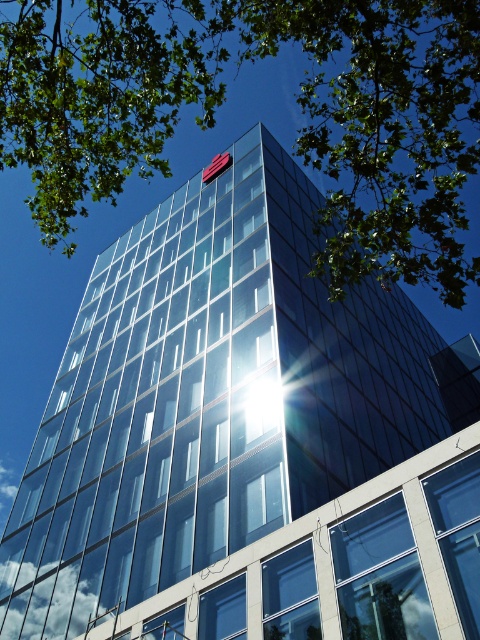
Consider the image. You are a photographer trying to capture the red fabric flag at upper center and the green leafy tree at upper left in the same frame. Based on their sizes, which object would appear bigger in your photo?

The green leafy tree at upper left would appear bigger in the photo since it is larger in size than the red fabric flag at upper center according to the description.

You are standing in front of the modern glass building and notice two points marked on the building facade. The first point is at coordinates point (80, 67) and the second is at point (212, 161). Which point is closer to you?

Point (80, 67) is closer to the viewer than point (212, 161).

You are standing in front of the modern glass building and notice the green leafy tree at upper left and the red fabric flag at upper center. Which object appears higher in the image?

The green leafy tree at upper left appears higher than the red fabric flag at upper center because it is taller.